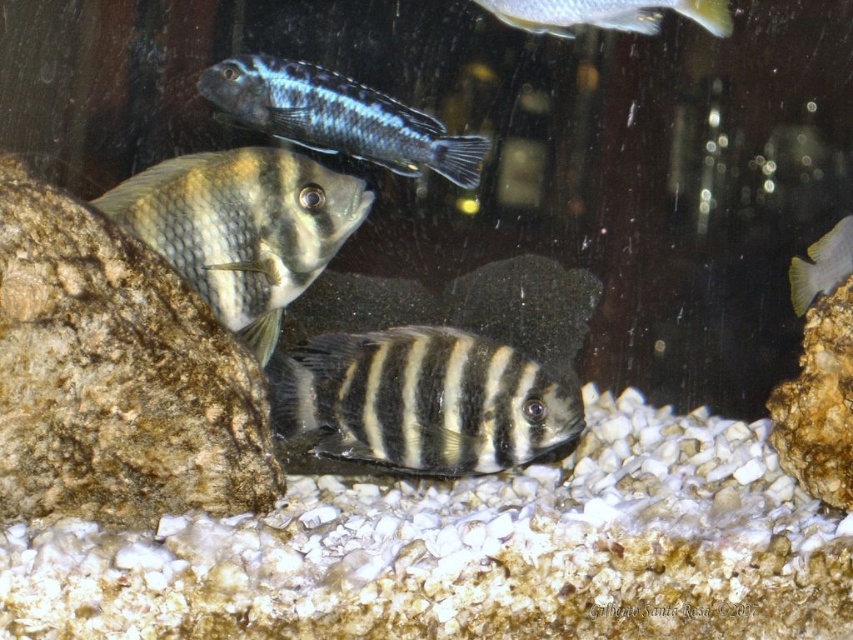
Is brown rough rock at lower left closer to camera compared to shiny silver fish at upper center?

Yes, it is in front of shiny silver fish at upper center.

Between brown rough rock at lower left and shiny silver fish at upper center, which one appears on the right side from the viewer's perspective?

From the viewer's perspective, shiny silver fish at upper center appears more on the right side.

Where is `brown rough rock at lower left`? The height and width of the screenshot is (640, 853). brown rough rock at lower left is located at coordinates (115, 376).

Where is `brown rough rock at lower left`? The width and height of the screenshot is (853, 640). brown rough rock at lower left is located at coordinates (115, 376).

Between point (41, 465) and point (828, 259), which one is positioned behind?

Point (828, 259)

This screenshot has width=853, height=640. I want to click on brown rough rock at lower left, so click(115, 376).

Can you confirm if brown rough rock at lower left is shorter than blue glossy fish at upper center?

No, brown rough rock at lower left is not shorter than blue glossy fish at upper center.

Which is in front, point (55, 260) or point (434, 147)?

Point (55, 260) is more forward.

Which is in front, point (45, 280) or point (283, 74)?

Point (45, 280)

At what (x,y) coordinates should I click in order to perform the action: click on brown rough rock at lower left. Please return your answer as a coordinate pair (x, y). Looking at the image, I should click on (115, 376).